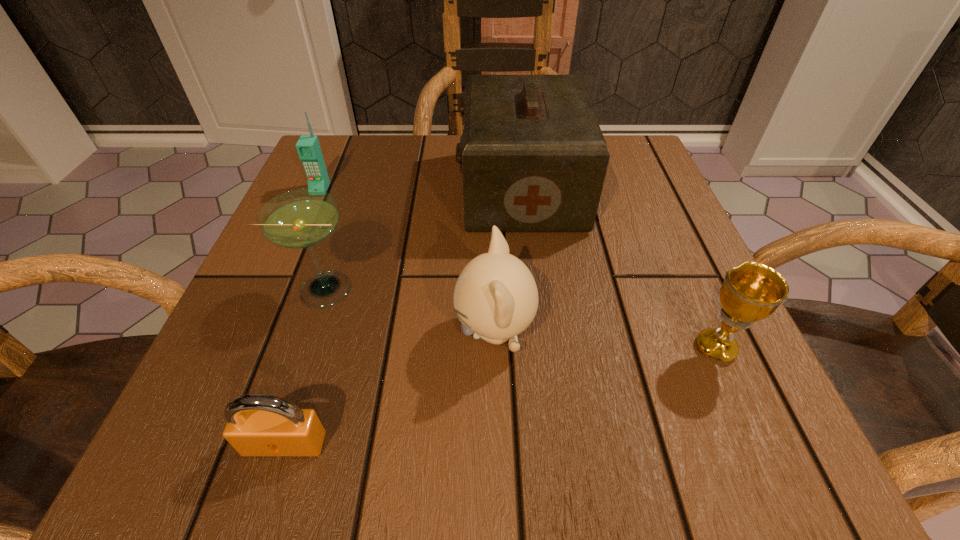
What are the coordinates of `the tallest object` in the screenshot? It's located at (533, 157).

The width and height of the screenshot is (960, 540). Identify the location of martini. (302, 218).

At what (x,y) coordinates should I click in order to perform the action: click on cellular telephone. Please return your answer as a coordinate pair (x, y). The width and height of the screenshot is (960, 540). Looking at the image, I should click on pos(308,147).

Locate an element on the screen. kitten is located at coordinates (495, 297).

Identify the location of chalice. The width and height of the screenshot is (960, 540). (751, 292).

At what (x,y) coordinates should I click in order to perform the action: click on padlock. Please return your answer as a coordinate pair (x, y). Looking at the image, I should click on (257, 424).

Where is `the nearest object`? the nearest object is located at coordinates (257, 424).

The width and height of the screenshot is (960, 540). What are the coordinates of `free space located on the left of the tallest object` in the screenshot? It's located at (336, 190).

Find the location of a particular element. This screenshot has height=540, width=960. vacant space located on the front of the martini is located at coordinates (285, 400).

This screenshot has width=960, height=540. What are the coordinates of `free region located 0.130m on the keypad of the cellular telephone` in the screenshot? It's located at (299, 239).